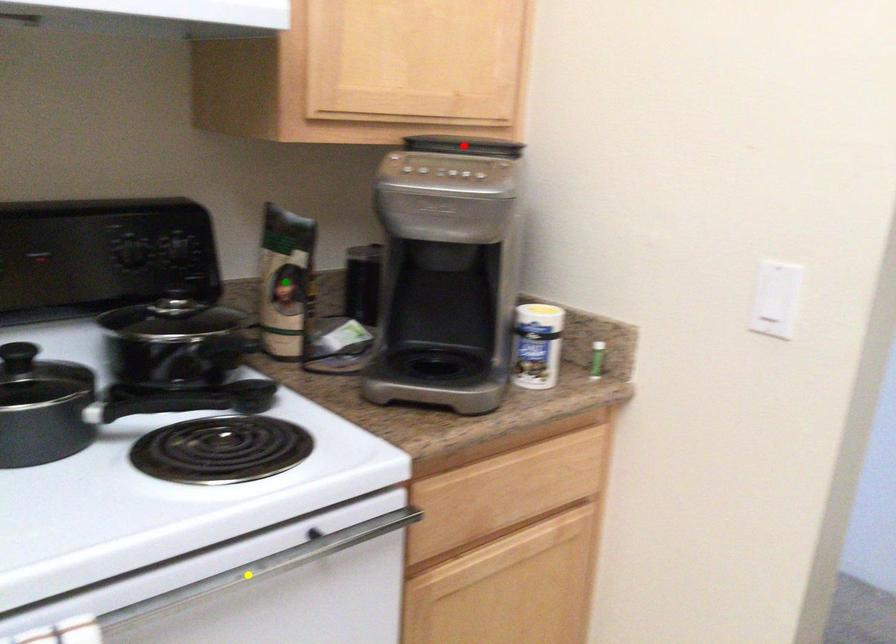
Order these from nearest to farthest:
yellow point, red point, green point

yellow point, red point, green point